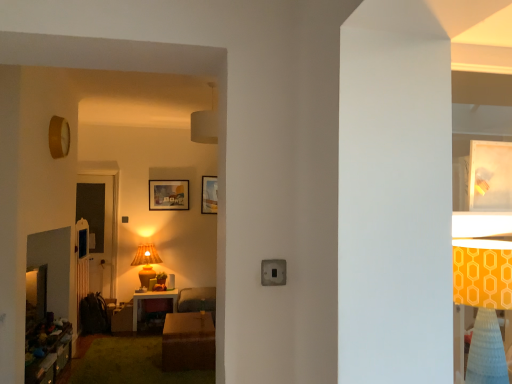
Question: Is matte wooden picture frame at center, which is counted as the third picture frame, starting from the right, taller than orange fabric lampshade at right?

Choices:
 (A) yes
 (B) no

Answer: (B)

Question: Can you confirm if matte wooden picture frame at center, the 2th picture frame positioned from the front, is thinner than orange fabric lampshade at right?

Choices:
 (A) yes
 (B) no

Answer: (A)

Question: Is matte wooden picture frame at center, which is counted as the third picture frame, starting from the right, with orange fabric lampshade at right?

Choices:
 (A) no
 (B) yes

Answer: (A)

Question: From the image's perspective, is matte wooden picture frame at center, which is the 1th picture frame in left-to-right order, under orange fabric lampshade at right?

Choices:
 (A) yes
 (B) no

Answer: (B)

Question: Is matte wooden picture frame at center, which is the 1th picture frame in left-to-right order, further to the viewer compared to orange fabric lampshade at right?

Choices:
 (A) no
 (B) yes

Answer: (B)

Question: Could you tell me if matte wooden picture frame at center, which is counted as the third picture frame, starting from the right, is turned towards orange fabric lampshade at right?

Choices:
 (A) yes
 (B) no

Answer: (A)

Question: Considering the relative positions of matte white picture frame at upper right, acting as the 1th picture frame starting from the front, and orange fabric lampshade at right in the image provided, is matte white picture frame at upper right, acting as the 1th picture frame starting from the front, to the left of orange fabric lampshade at right from the viewer's perspective?

Choices:
 (A) yes
 (B) no

Answer: (B)

Question: From the image's perspective, is matte white picture frame at upper right, the third picture frame positioned from the back, on top of orange fabric lampshade at right?

Choices:
 (A) no
 (B) yes

Answer: (B)

Question: Considering the relative sizes of matte white picture frame at upper right, acting as the 1th picture frame starting from the front, and orange fabric lampshade at right in the image provided, is matte white picture frame at upper right, acting as the 1th picture frame starting from the front, smaller than orange fabric lampshade at right?

Choices:
 (A) no
 (B) yes

Answer: (B)

Question: Does matte white picture frame at upper right, acting as the 1th picture frame starting from the front, have a lesser width compared to orange fabric lampshade at right?

Choices:
 (A) yes
 (B) no

Answer: (A)

Question: Does matte white picture frame at upper right, acting as the third picture frame starting from the left, have a lesser height compared to orange fabric lampshade at right?

Choices:
 (A) yes
 (B) no

Answer: (A)

Question: Could you tell me if matte white picture frame at upper right, acting as the third picture frame starting from the left, is turned towards orange fabric lampshade at right?

Choices:
 (A) no
 (B) yes

Answer: (A)

Question: Considering the relative sizes of matte wooden picture frame at center, which is the 2th picture frame from back to front, and matte brown table lamp at center in the image provided, is matte wooden picture frame at center, which is the 2th picture frame from back to front, bigger than matte brown table lamp at center?

Choices:
 (A) yes
 (B) no

Answer: (B)